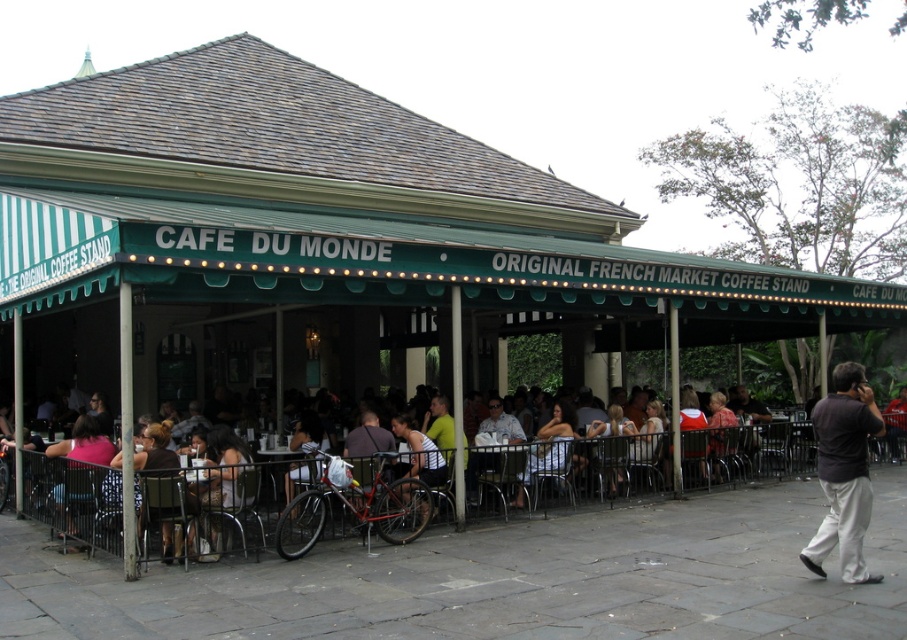
You are a photographer standing in front of the Cafe Du Monde exterior. You notice a white fabric dress at lower center and a matte black shirt at center. Which clothing item appears shorter in the photo?

The white fabric dress at lower center appears shorter than the matte black shirt at center because it is not as tall as the matte black shirt at center.

You are a customer at Cafe Du Monde and want to place your coffee cup on the table. The table has the white textured tank top at center and the matte black bicycle at center. Which object should you place your cup on to avoid it being under the bicycle?

You should place your coffee cup on the white textured tank top at center because it is above the matte black bicycle at center, so placing it there would keep the cup above the bicycle and not underneath it.

You are a photographer at Cafe Du Monde, and you want to capture a photo of the white textured tank top at center and the pink fabric shirt at lower left. Which of the two items should you focus on if you want to highlight the narrower clothing item?

The white textured tank top at center has a lesser width compared to the pink fabric shirt at lower left, so you should focus on the white textured tank top at center to highlight the narrower clothing item.